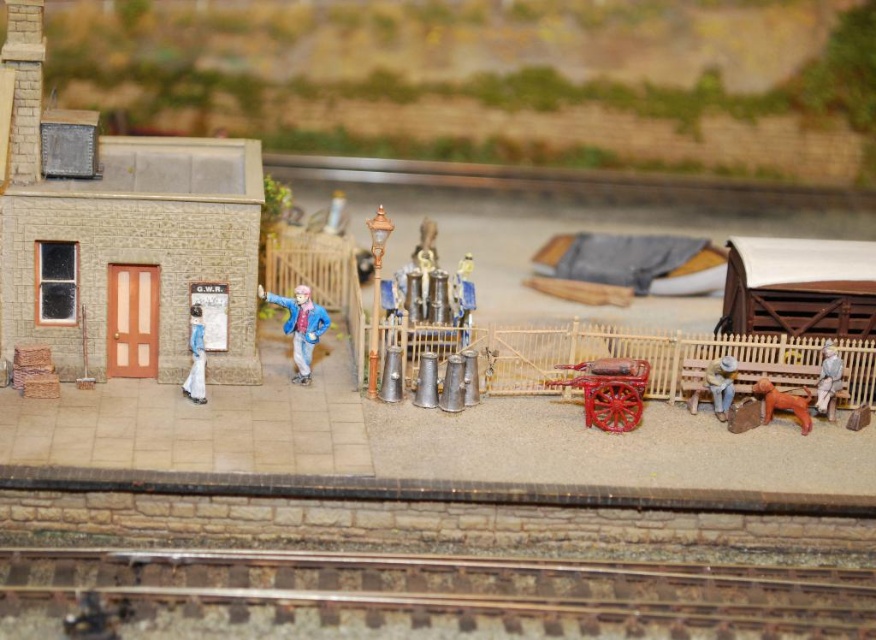
Question: Based on their relative distances, which object is nearer to the matte blue dress at left?

Choices:
 (A) brown matte dog at lower right
 (B) smooth wooden cart at center
 (C) smooth metal tracks at center

Answer: (B)

Question: Which point is farther to the camera?

Choices:
 (A) (295, 358)
 (B) (723, 403)

Answer: (A)

Question: Can you confirm if smooth metal tracks at center is positioned to the right of brown wooden bench at right?

Choices:
 (A) no
 (B) yes

Answer: (A)

Question: Does smooth blue shirt at center have a greater width compared to brown wooden bench at right?

Choices:
 (A) yes
 (B) no

Answer: (A)

Question: Which point is farther to the camera?

Choices:
 (A) smooth metal tracks at center
 (B) brown wooden bench at right

Answer: (B)

Question: Can you confirm if brown wooden bench at right is thinner than matte blue dress at left?

Choices:
 (A) yes
 (B) no

Answer: (B)